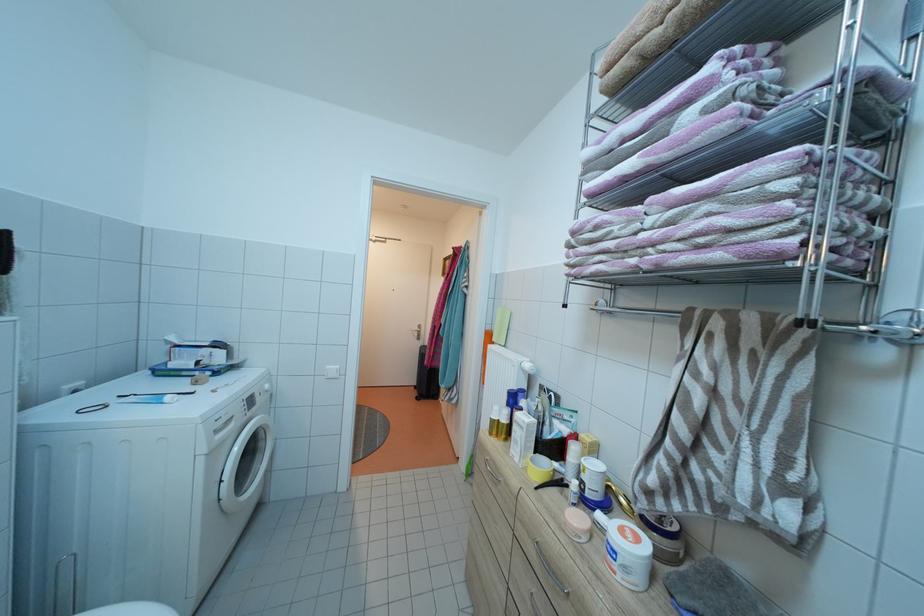
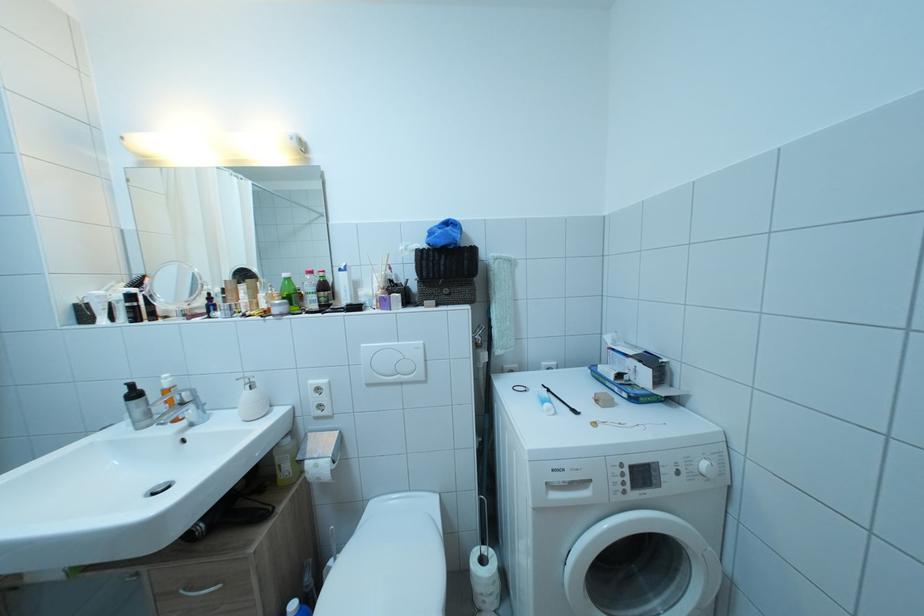
Question: The camera is either moving clockwise (left) or counter-clockwise (right) around the object. The first image is from the beginning of the video and the second image is from the end. Is the camera moving left or right when shooting the video?

Choices:
 (A) Left
 (B) Right

Answer: (B)